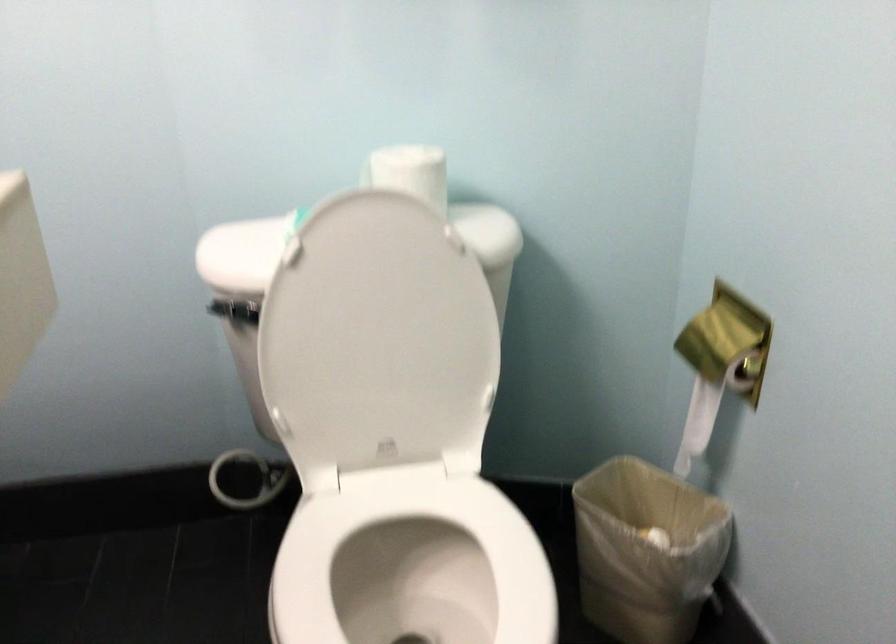
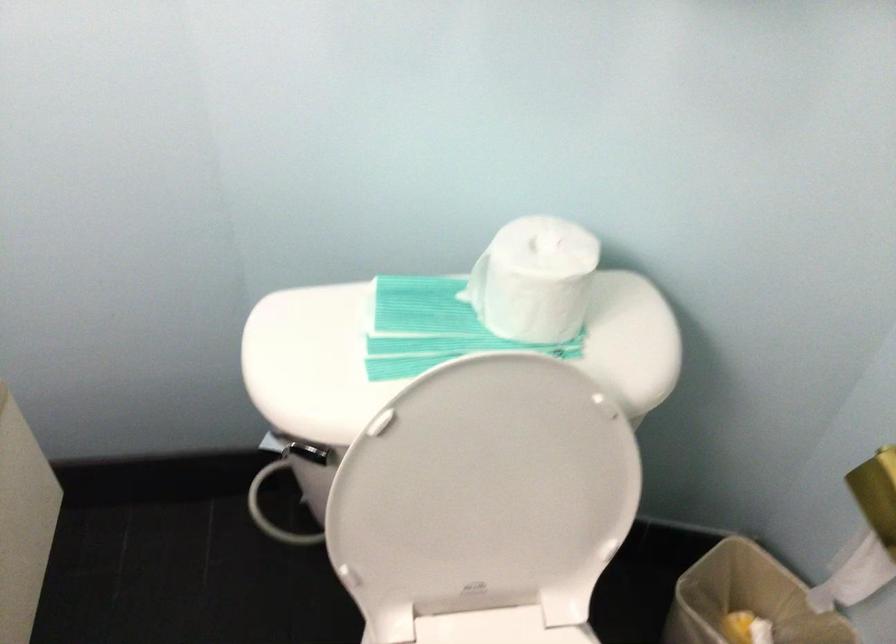
Locate, in the second image, the point that corresponds to point (406, 480) in the first image.

(497, 627)